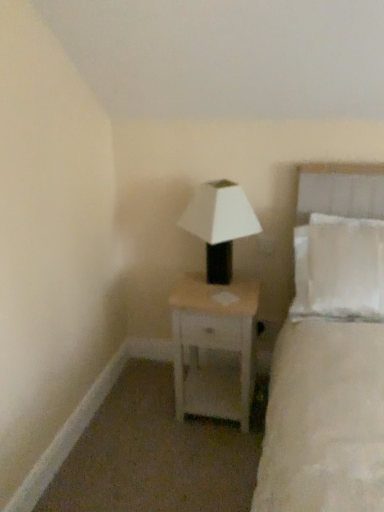
Question: Should I look upward or downward to see white matte lamp at center?

Choices:
 (A) down
 (B) up

Answer: (B)

Question: Can you confirm if white matte nightstand at center is shorter than white fabric bed at right?

Choices:
 (A) no
 (B) yes

Answer: (B)

Question: Can you confirm if white matte nightstand at center is thinner than white fabric bed at right?

Choices:
 (A) no
 (B) yes

Answer: (A)

Question: Considering the relative sizes of white matte nightstand at center and white fabric bed at right in the image provided, is white matte nightstand at center taller than white fabric bed at right?

Choices:
 (A) no
 (B) yes

Answer: (A)

Question: Is white matte nightstand at center with white fabric bed at right?

Choices:
 (A) yes
 (B) no

Answer: (B)

Question: From a real-world perspective, is white matte nightstand at center physically below white fabric bed at right?

Choices:
 (A) yes
 (B) no

Answer: (A)

Question: Is white matte nightstand at center in front of white fabric bed at right?

Choices:
 (A) yes
 (B) no

Answer: (B)

Question: Is white matte lamp at center facing away from white fabric bed at right?

Choices:
 (A) no
 (B) yes

Answer: (A)

Question: From the image's perspective, is white matte lamp at center on white fabric bed at right?

Choices:
 (A) no
 (B) yes

Answer: (B)

Question: Is white matte lamp at center not within white fabric bed at right?

Choices:
 (A) yes
 (B) no

Answer: (A)

Question: Considering the relative sizes of white matte lamp at center and white fabric bed at right in the image provided, is white matte lamp at center thinner than white fabric bed at right?

Choices:
 (A) no
 (B) yes

Answer: (B)

Question: Is white matte lamp at center next to white fabric bed at right?

Choices:
 (A) yes
 (B) no

Answer: (B)

Question: Does white matte lamp at center have a smaller size compared to white fabric bed at right?

Choices:
 (A) no
 (B) yes

Answer: (B)

Question: Is white fabric bed at right positioned with its back to white matte nightstand at center?

Choices:
 (A) no
 (B) yes

Answer: (A)